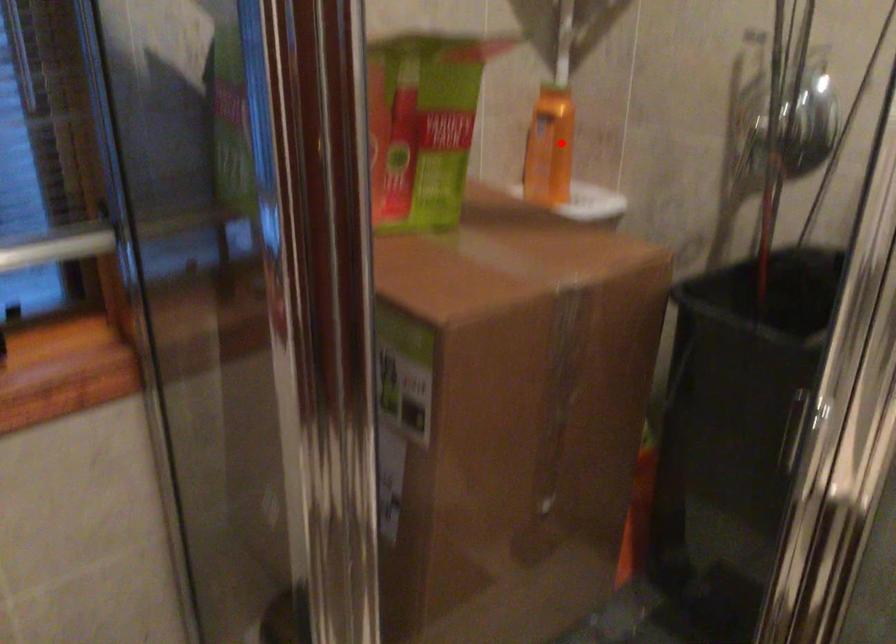
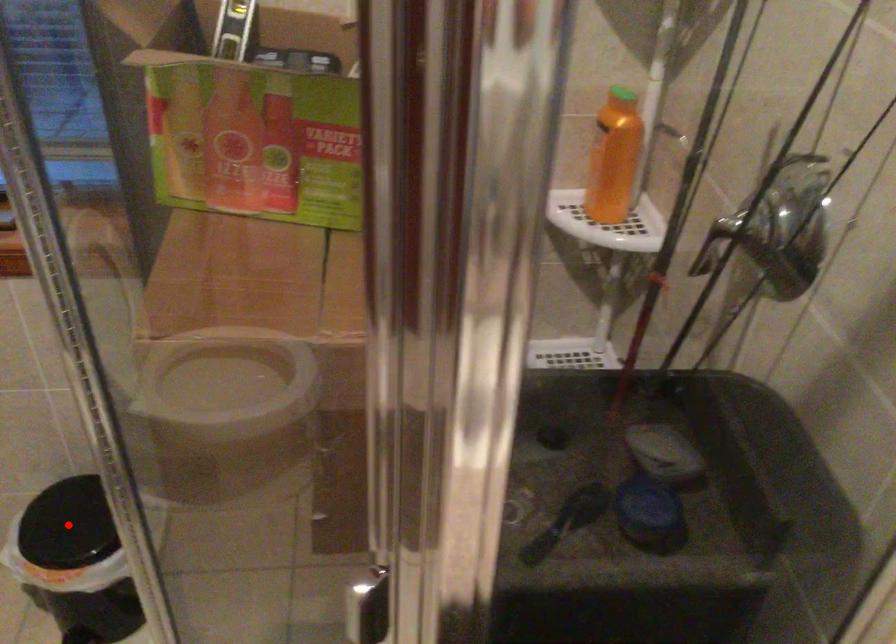
I am providing you with two images of the same scene from different viewpoints. A red point is marked on the first image and another point is marked on the second image. Are the points marked in image1 and image2 representing the same 3D position?

No